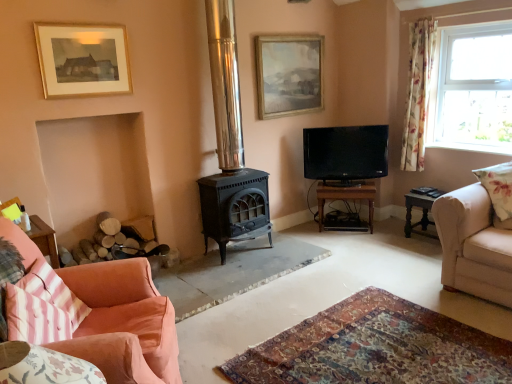
Find the location of a particular element. This screenshot has height=384, width=512. vacant space in front of black cast iron stove at center is located at coordinates (241, 278).